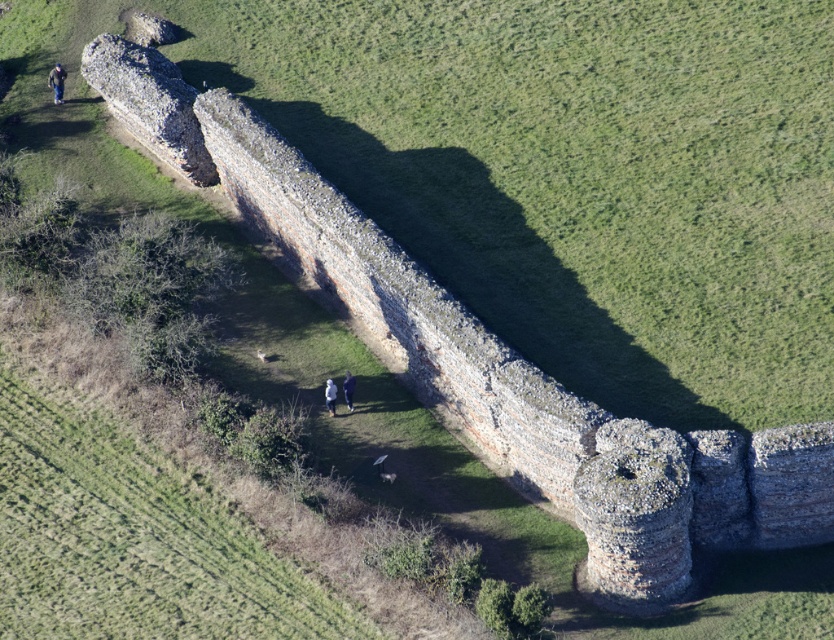
Question: Does dark blue jeans at upper left have a greater width compared to white fabric jacket at center?

Choices:
 (A) yes
 (B) no

Answer: (A)

Question: Can you confirm if white fabric jacket at center is positioned above blue fabric jacket at center?

Choices:
 (A) no
 (B) yes

Answer: (A)

Question: Is white fabric jacket at center thinner than blue fabric jacket at center?

Choices:
 (A) no
 (B) yes

Answer: (B)

Question: Based on their relative distances, which object is farther from the dark blue jeans at upper left?

Choices:
 (A) white fabric jacket at center
 (B) blue fabric jacket at center

Answer: (B)

Question: Which object is closer to the camera taking this photo?

Choices:
 (A) white fabric jacket at center
 (B) dark blue jeans at upper left
 (C) blue fabric jacket at center

Answer: (A)

Question: Which point is farther from the camera taking this photo?

Choices:
 (A) (350, 384)
 (B) (56, 84)

Answer: (B)